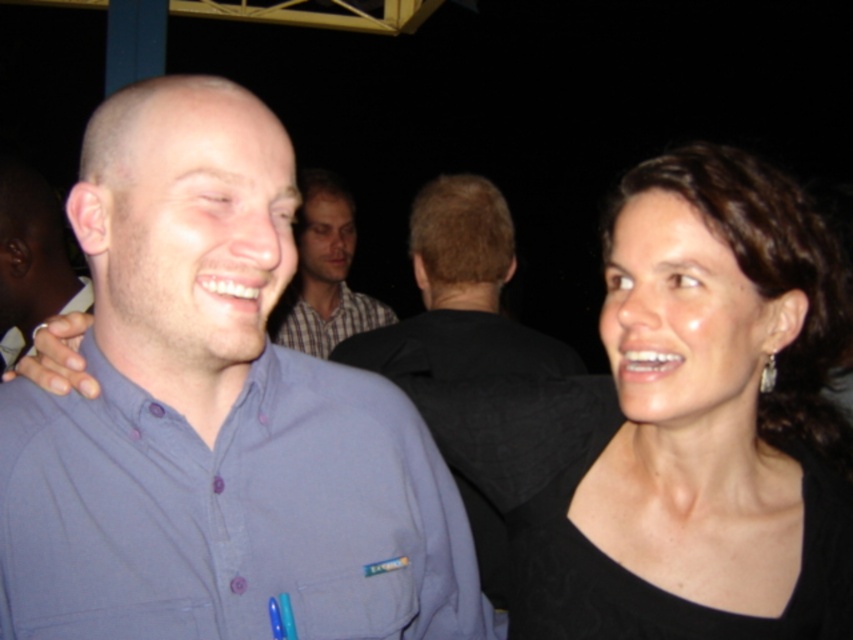
Question: Which point is closer to the camera taking this photo?

Choices:
 (A) (47, 224)
 (B) (497, 236)

Answer: (A)

Question: Does black matte dress at upper right appear over matte blue shirt at left?

Choices:
 (A) no
 (B) yes

Answer: (A)

Question: Which point is farther from the camera taking this photo?

Choices:
 (A) (85, 232)
 (B) (0, 241)
 (C) (726, 356)

Answer: (B)

Question: Which of the following is the farthest from the observer?

Choices:
 (A) dark gray fabric jacket at center
 (B) plaid shirt at center
 (C) blue button-down shirt at center

Answer: (B)

Question: Does black matte dress at upper right appear over matte blue shirt at left?

Choices:
 (A) yes
 (B) no

Answer: (B)

Question: Can you confirm if blue button-down shirt at center is bigger than dark gray fabric jacket at center?

Choices:
 (A) yes
 (B) no

Answer: (B)